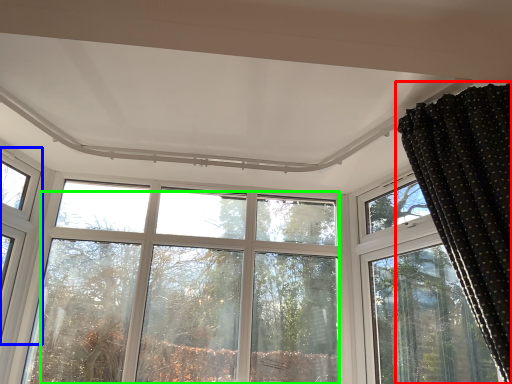
Question: Which is farther away from curtain (highlighted by a red box)? window (highlighted by a blue box) or tree (highlighted by a green box)?

Choices:
 (A) window
 (B) tree

Answer: (A)